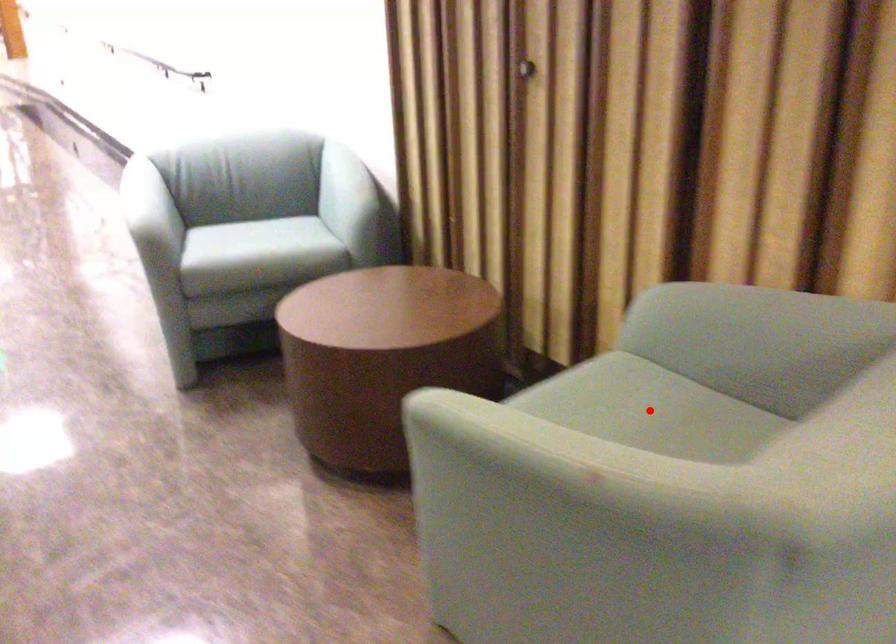
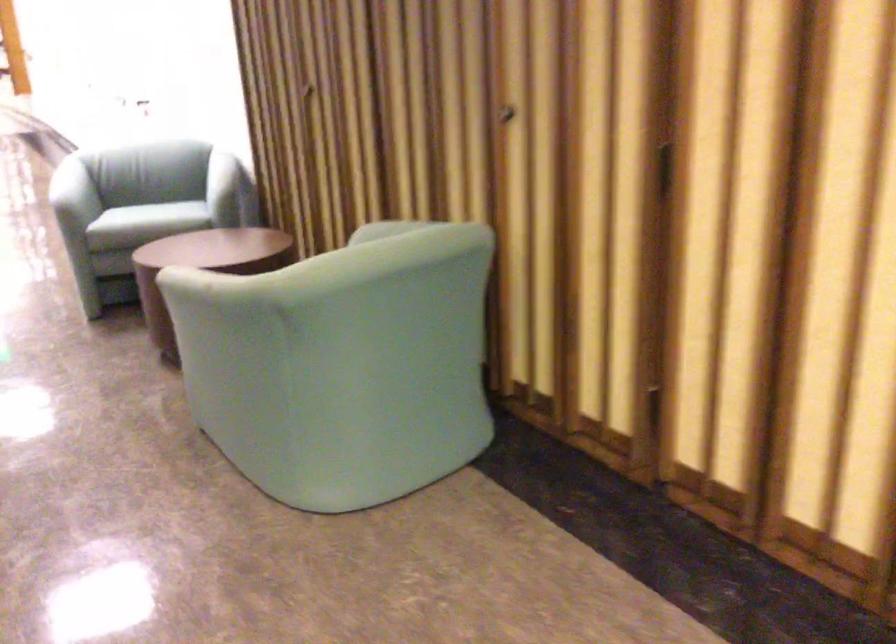
Question: I am providing you with two images of the same scene from different viewpoints. A red point is marked on the first image. Is the red point's position out of view in image 2?

Choices:
 (A) Yes
 (B) No

Answer: (A)